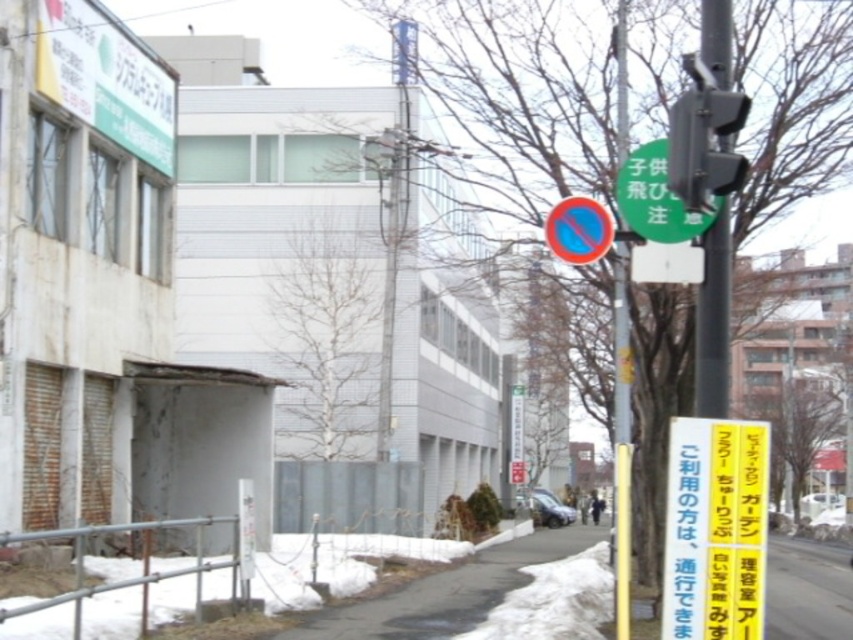
Can you confirm if metallic pole at right is bigger than shiny black car at center?

No.

Which is in front, point (726, 228) or point (564, 518)?

Point (726, 228) is in front.

The image size is (853, 640). I want to click on metallic pole at right, so click(712, 321).

Does point (567, 536) lie behind point (722, 22)?

Yes, it is behind point (722, 22).

Does point (461, 580) come farther from viewer compared to point (723, 147)?

Yes, point (461, 580) is behind point (723, 147).

At what (x,y) coordinates should I click in order to perform the action: click on black asphalt pavement at lower center. Please return your answer as a coordinate pair (x, y). Looking at the image, I should click on (447, 593).

Does green matte sign at upper center appear on the left side of red plastic circle at center?

No, green matte sign at upper center is not to the left of red plastic circle at center.

Which is above, green matte sign at upper center or red plastic circle at center?

Positioned higher is green matte sign at upper center.

Between point (708, 218) and point (576, 208), which one is positioned in front?

Positioned in front is point (708, 218).

Identify the location of green matte sign at upper center. This screenshot has height=640, width=853. (657, 198).